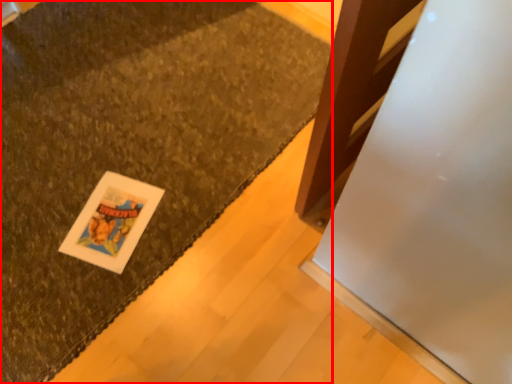
Question: From the image's perspective, considering the relative positions of mat (annotated by the red box) and card in the image provided, where is mat (annotated by the red box) located with respect to the staircase?

Choices:
 (A) above
 (B) below

Answer: (A)